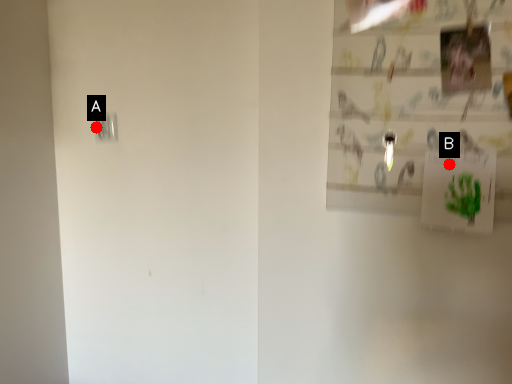
Question: Two points are circled on the image, labeled by A and B beside each circle. Among these points, which one is nearest to the camera?

Choices:
 (A) A is closer
 (B) B is closer

Answer: (B)